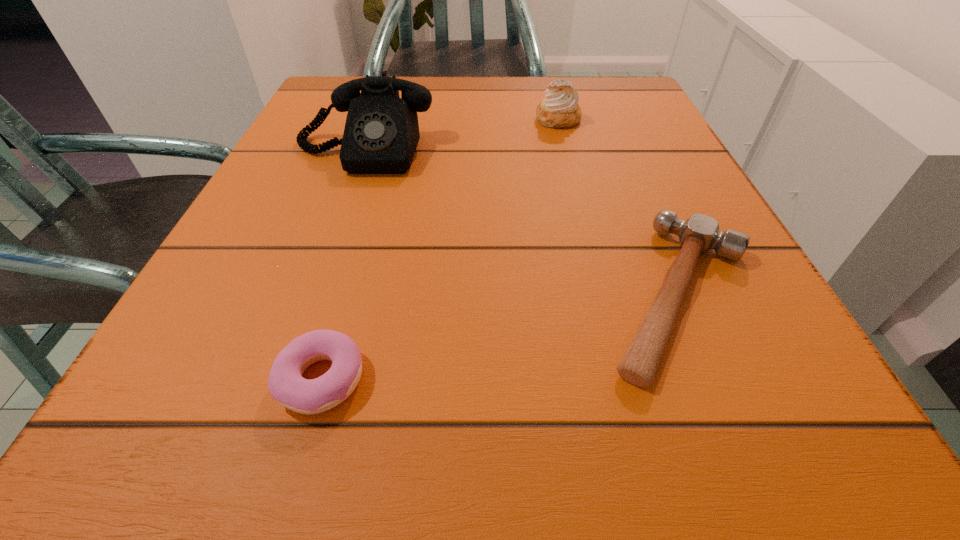
Image resolution: width=960 pixels, height=540 pixels. In order to click on telephone in this screenshot , I will do `click(381, 134)`.

The image size is (960, 540). Find the location of `the third shortest object`. the third shortest object is located at coordinates (560, 109).

Find the location of `the right pastry`. the right pastry is located at coordinates (560, 109).

Identify the location of hammer. The width and height of the screenshot is (960, 540). (699, 233).

At what (x,y) coordinates should I click in order to perform the action: click on the nearer pastry. Please return your answer as a coordinate pair (x, y). Image resolution: width=960 pixels, height=540 pixels. Looking at the image, I should click on (287, 386).

At what (x,y) coordinates should I click in order to perform the action: click on the left pastry. Please return your answer as a coordinate pair (x, y). The image size is (960, 540). Looking at the image, I should click on (287, 386).

This screenshot has height=540, width=960. Identify the location of blank space located on the dial of the telephone. (307, 310).

Locate an element on the screen. free space located 0.120m on the right of the taller pastry is located at coordinates [641, 119].

Where is `free region located 0.090m on the left of the hammer`? free region located 0.090m on the left of the hammer is located at coordinates (523, 295).

Image resolution: width=960 pixels, height=540 pixels. I want to click on free region located on the back of the left pastry, so click(372, 200).